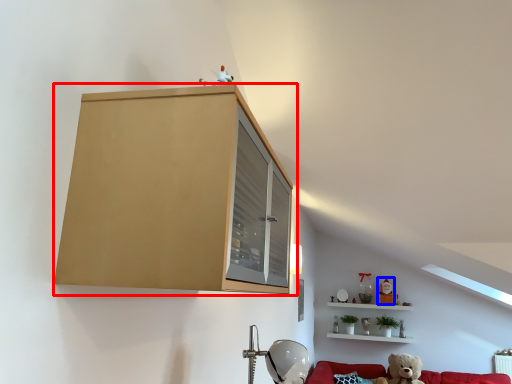
Question: Which object appears farthest to the camera in this image, cabinetry (highlighted by a red box) or toy (highlighted by a blue box)?

Choices:
 (A) cabinetry
 (B) toy

Answer: (B)